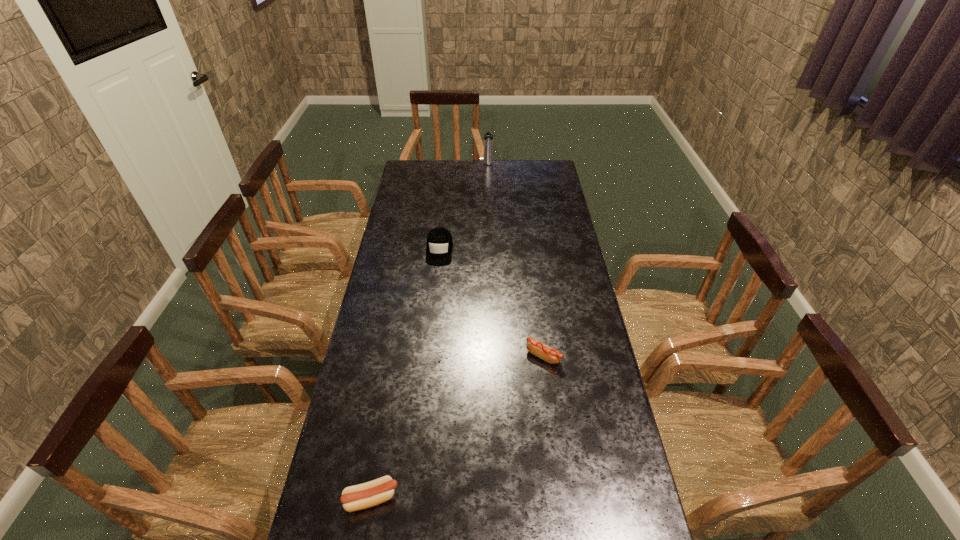
Locate an element on the screen. Image resolution: width=960 pixels, height=540 pixels. vacant space that's between the farther sausage and the nearer sausage is located at coordinates (458, 427).

Where is `free area in between the thermos bottle and the second nearest object`? The image size is (960, 540). free area in between the thermos bottle and the second nearest object is located at coordinates (516, 260).

Identify the location of vacant space that's between the cap and the farther sausage. This screenshot has height=540, width=960. (492, 303).

The width and height of the screenshot is (960, 540). I want to click on vacant space that's between the third object from left to right and the nearest object, so click(430, 331).

Locate an element on the screen. The image size is (960, 540). free space between the cap and the second object from right to left is located at coordinates [x=464, y=207].

Locate an element on the screen. The height and width of the screenshot is (540, 960). vacant point located between the cap and the nearest object is located at coordinates (405, 374).

You are a GUI agent. You are given a task and a screenshot of the screen. Output one action in this format:
    pyautogui.click(x=<x>, y=<y>)
    Task: Click on the vacant space that's between the left sausage and the second nearest object
    This screenshot has height=540, width=960.
    Given the screenshot: What is the action you would take?
    pyautogui.click(x=458, y=427)

Where is `vacant area that lies between the tallest object and the nearest object`? The width and height of the screenshot is (960, 540). vacant area that lies between the tallest object and the nearest object is located at coordinates (430, 331).

The width and height of the screenshot is (960, 540). In order to click on free spot between the left sausage and the cap in this screenshot , I will do `click(405, 374)`.

Locate an element on the screen. This screenshot has height=540, width=960. vacant region between the nearest object and the tallest object is located at coordinates (430, 331).